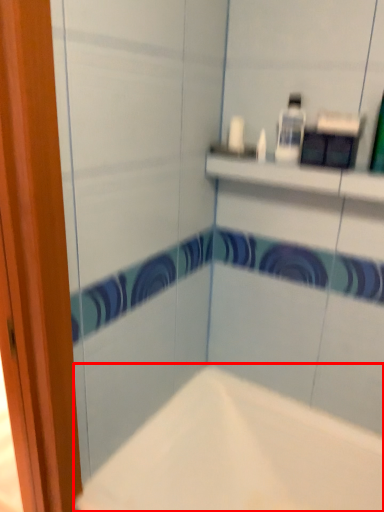
Question: From the image's perspective, where is bathtub (annotated by the red box) located relative to toiletry?

Choices:
 (A) above
 (B) below

Answer: (B)